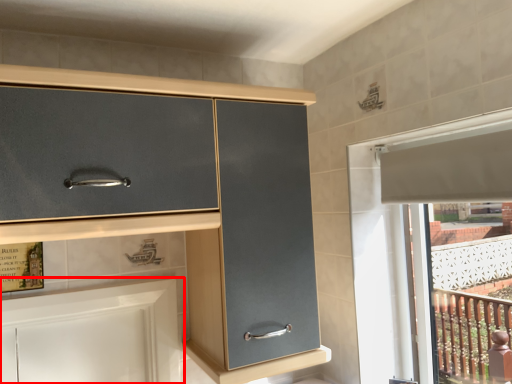
Question: Where is cabinetry (annotated by the red box) located in relation to cabinetry in the image?

Choices:
 (A) right
 (B) left

Answer: (B)